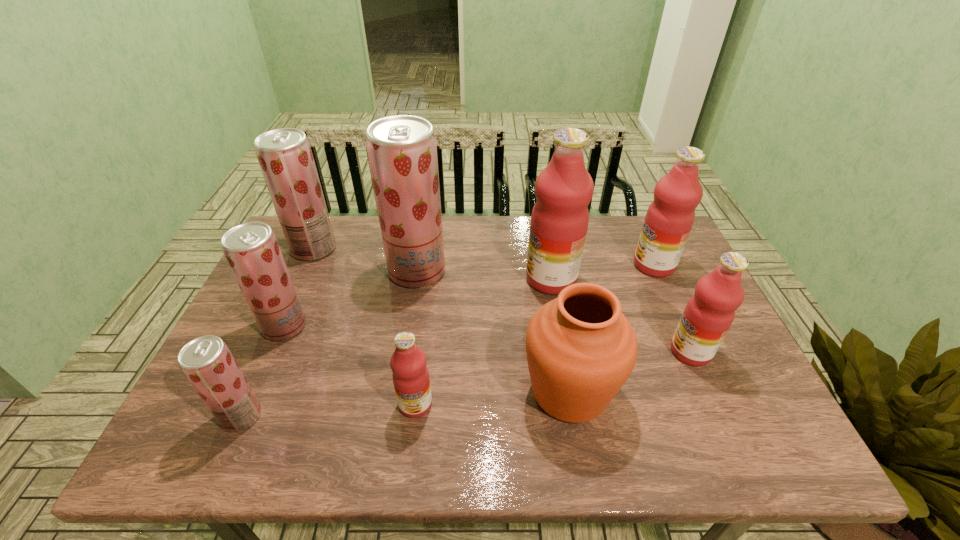
Identify the location of vacant region located on the label of the third farthest pink fruit juice. This screenshot has width=960, height=540. (599, 352).

The width and height of the screenshot is (960, 540). What are the coordinates of `vacant space situated on the label of the third farthest pink fruit juice` in the screenshot? It's located at click(x=611, y=352).

Find the location of `blank space located on the label of the third farthest pink fruit juice`. blank space located on the label of the third farthest pink fruit juice is located at coordinates (519, 352).

The image size is (960, 540). What are the coordinates of `blank area located on the left of the urn` in the screenshot? It's located at (478, 391).

Locate an element on the screen. free point located 0.240m on the back of the smallest strawberry fruit juice is located at coordinates (284, 321).

The image size is (960, 540). Find the location of `free space located 0.050m on the label of the leftmost pink fruit juice`. free space located 0.050m on the label of the leftmost pink fruit juice is located at coordinates (411, 441).

The height and width of the screenshot is (540, 960). Identify the location of urn present at the near edge. [581, 349].

I want to click on fruit juice that is at the near edge, so click(x=206, y=361).

Locate an element on the screen. object that is at the far left corner is located at coordinates (285, 157).

The width and height of the screenshot is (960, 540). I want to click on object that is at the near left corner, so pos(206,361).